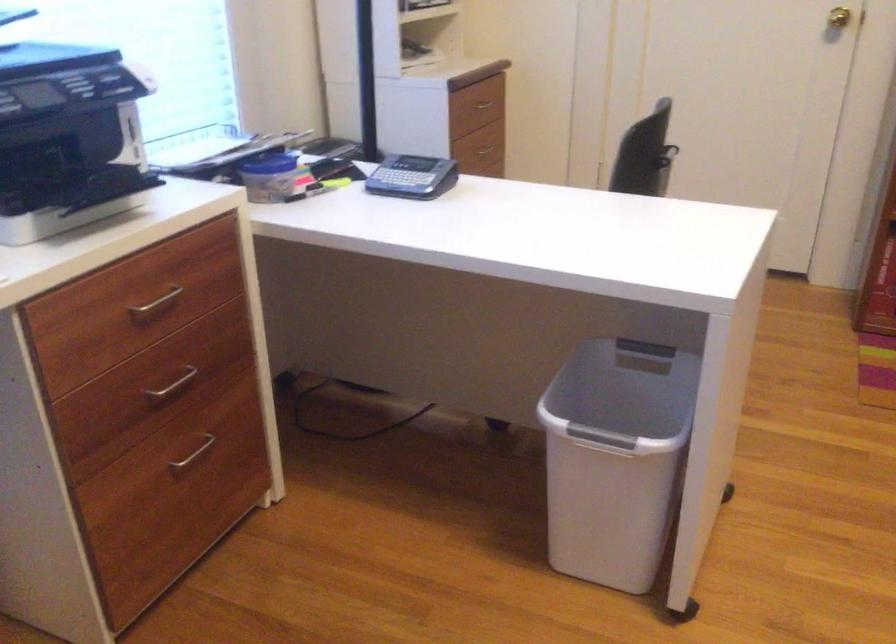
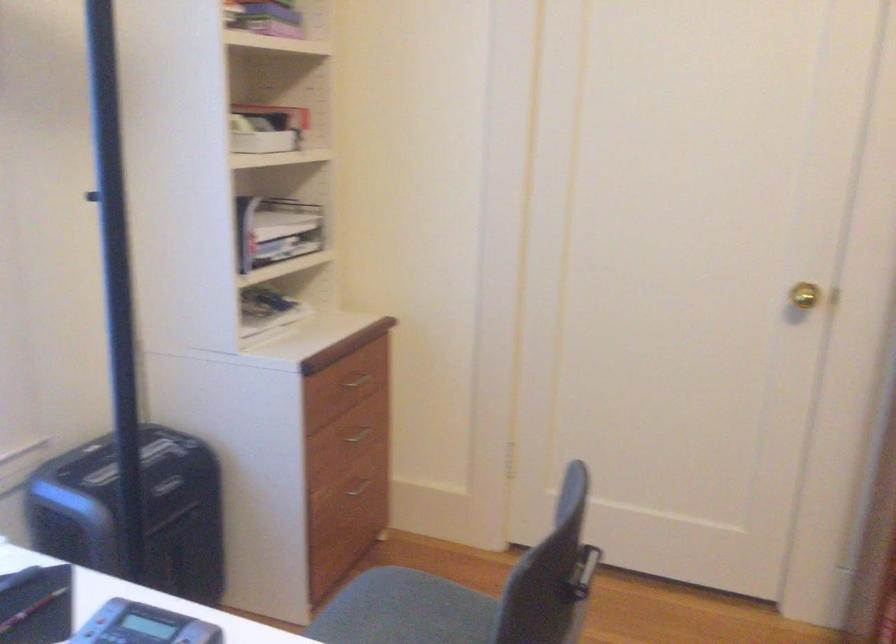
In the second image, find the point that corresponds to point (478, 105) in the first image.

(356, 381)